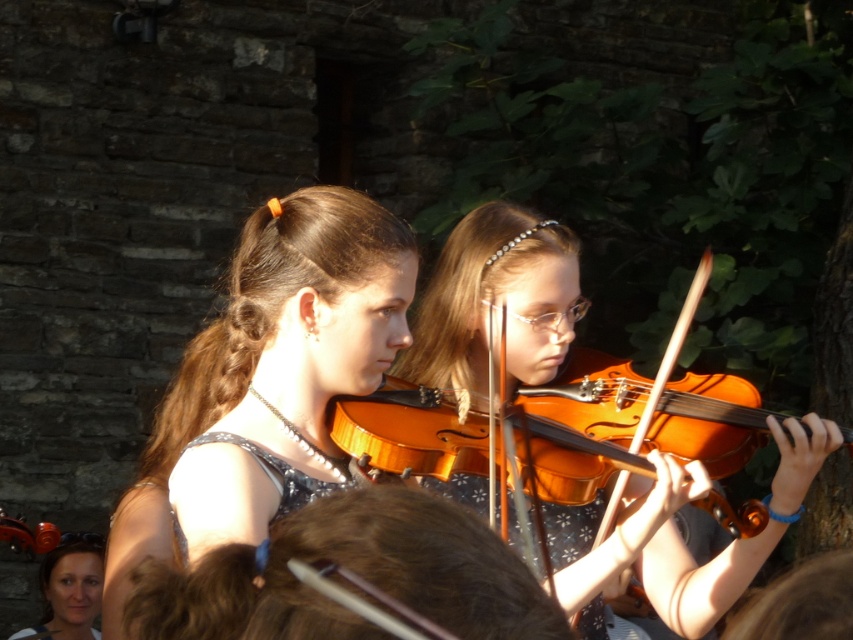
Can you confirm if brown hair at left is bigger than sparkly silver dress at center?

No, brown hair at left is not bigger than sparkly silver dress at center.

Does brown hair at left appear on the left side of sparkly silver dress at center?

Incorrect, brown hair at left is not on the left side of sparkly silver dress at center.

Who is more distant from viewer, [244,577] or [332,484]?

Point [332,484]

Where is `brown hair at left`? The height and width of the screenshot is (640, 853). brown hair at left is located at coordinates point(194,596).

Does shiny brown hair at center have a larger size compared to matte orange violin at center?

Actually, shiny brown hair at center might be smaller than matte orange violin at center.

Which is below, shiny brown hair at center or matte orange violin at center?

Positioned lower is shiny brown hair at center.

Who is more forward, [227,360] or [648,588]?

Point [227,360] is more forward.

Locate an element on the screen. The width and height of the screenshot is (853, 640). shiny brown hair at center is located at coordinates (267, 380).

Who is shorter, matte orange violin at center or sparkly silver dress at center?

sparkly silver dress at center

Is matte orange violin at center above sparkly silver dress at center?

Yes, matte orange violin at center is above sparkly silver dress at center.

Consider the image. Who is more distant from viewer, (770, 547) or (177, 520)?

Point (770, 547)

In order to click on matte orange violin at center in this screenshot , I will do `click(474, 346)`.